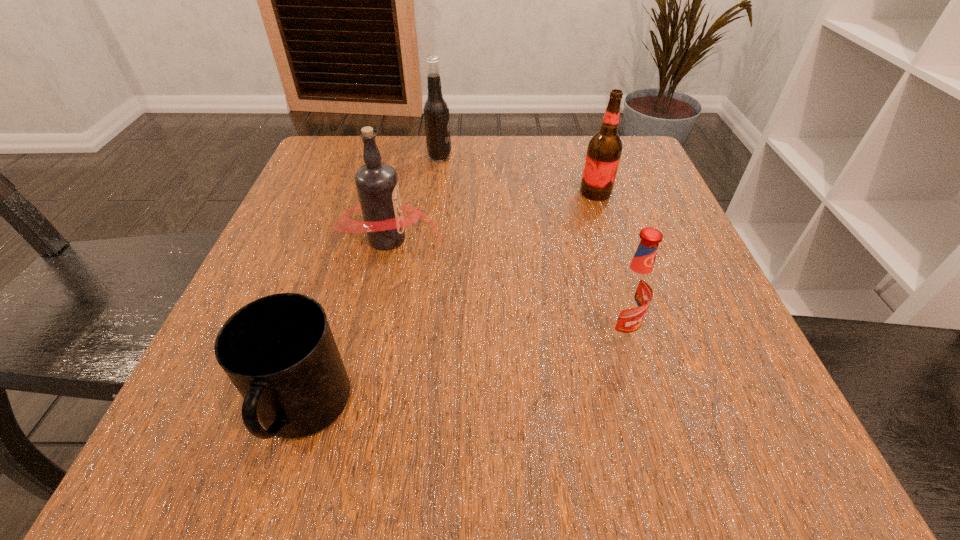
You are a GUI agent. You are given a task and a screenshot of the screen. Output one action in this format:
    pyautogui.click(x=<x>, y=<y>)
    Task: Click on the vacant space that satisfies the following two spatial constraints: 1. on the label of the farthest root beer; 2. on the back side of the second nearest object
    The width and height of the screenshot is (960, 540).
    Given the screenshot: What is the action you would take?
    pyautogui.click(x=417, y=335)